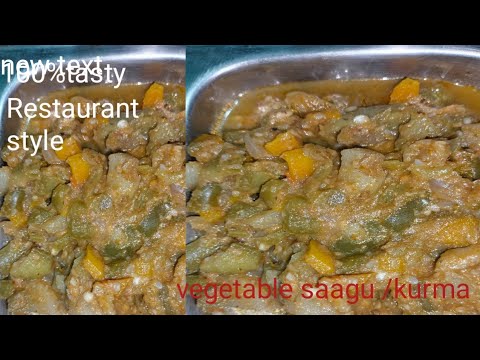
In order to click on countertop in this screenshot , I will do `click(211, 54)`, `click(75, 50)`.